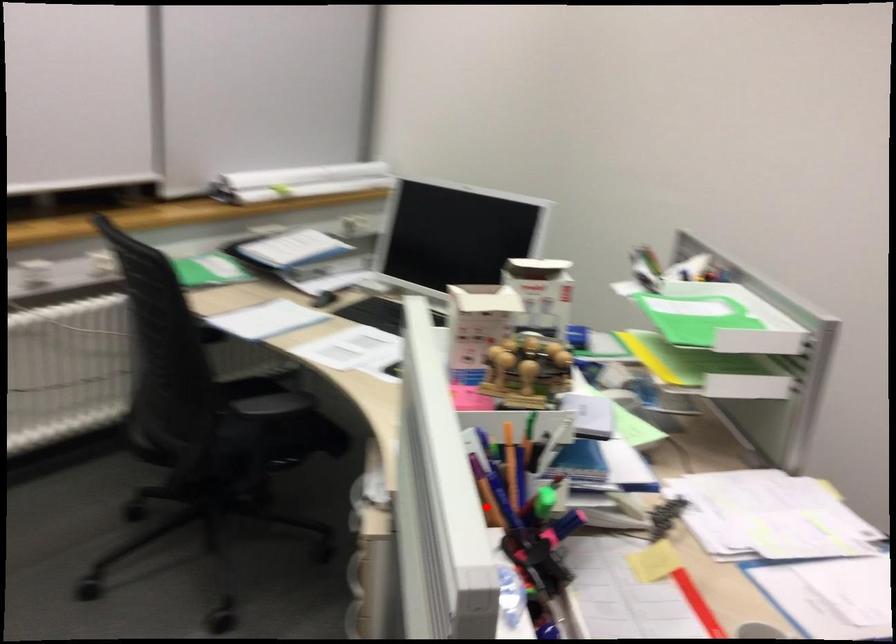
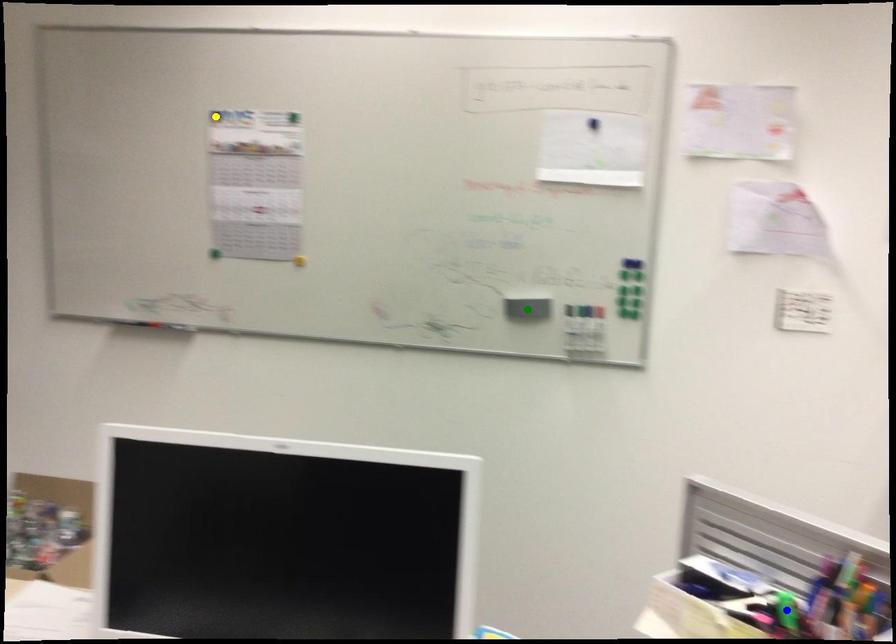
Question: I am providing you with two images of the same scene from different viewpoints. A red point is marked on the first image. You are given multiple points on the second image. Which point in image 2 represents the same 3d spot as the red point in image 1?

Choices:
 (A) green point
 (B) yellow point
 (C) blue point

Answer: (C)